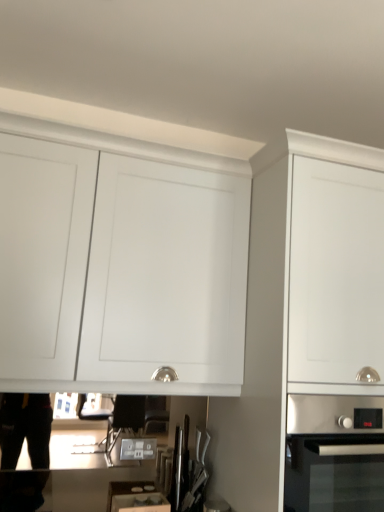
Question: Is white matte cabinet at upper center, the second cabinetry positioned from the right, in front of or behind stainless steel oven at lower right in the image?

Choices:
 (A) front
 (B) behind

Answer: (B)

Question: Is white matte cabinet at upper center, the second cabinetry positioned from the right, spatially inside stainless steel oven at lower right, or outside of it?

Choices:
 (A) outside
 (B) inside

Answer: (A)

Question: Which of these objects is positioned closest to the white matte cabinet at upper center, placed as the 1th cabinetry when sorted from left to right?

Choices:
 (A) stainless steel knife block at center
 (B) white matte cabinet at center, placed as the 1th cabinetry when sorted from right to left
 (C) matte white drawer at lower center
 (D) stainless steel oven at lower right

Answer: (B)

Question: Considering the real-world distances, which object is closest to the stainless steel knife block at center?

Choices:
 (A) matte white drawer at lower center
 (B) stainless steel oven at lower right
 (C) white matte cabinet at upper center, the second cabinetry positioned from the right
 (D) white matte cabinet at center, placed as the 2th cabinetry when sorted from left to right

Answer: (A)